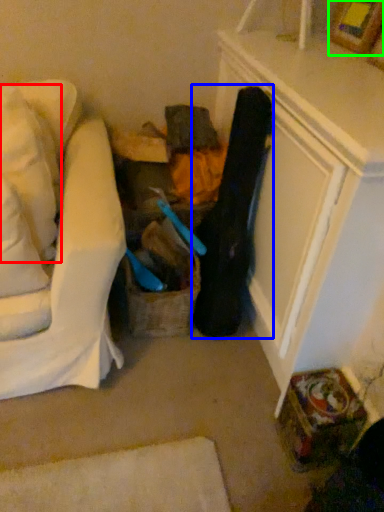
Question: Which object is the closest to the pillow (highlighted by a red box)? Choose among these: clothing (highlighted by a blue box) or picture frame (highlighted by a green box).

Choices:
 (A) clothing
 (B) picture frame

Answer: (A)